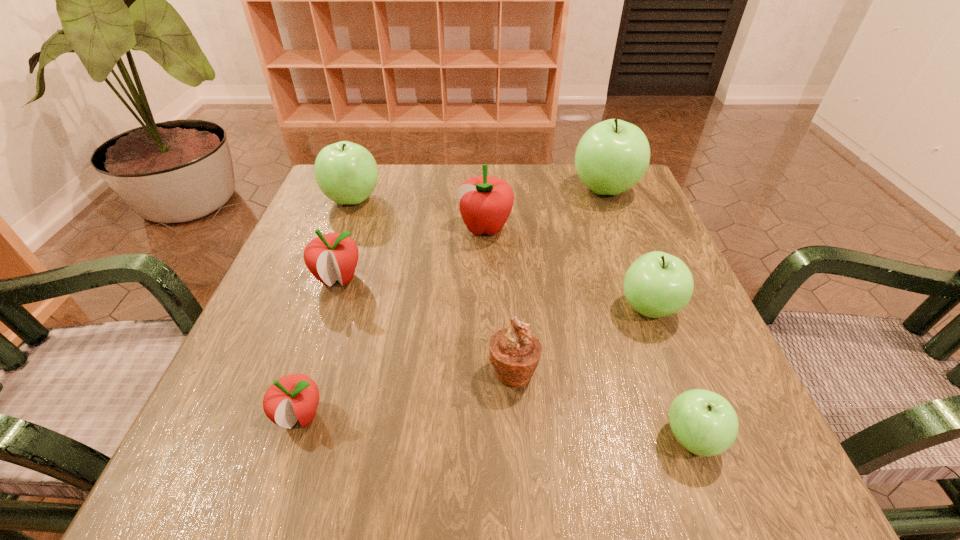
At what (x,y) coordinates should I click in order to perform the action: click on object that is at the far right corner. Please return your answer as a coordinate pair (x, y). Image resolution: width=960 pixels, height=540 pixels. Looking at the image, I should click on (612, 156).

What are the coordinates of `object situated at the near right corner` in the screenshot? It's located at (703, 422).

You are a GUI agent. You are given a task and a screenshot of the screen. Output one action in this format:
    pyautogui.click(x=<x>, y=<y>)
    Task: Click on the free space at the far edge
    
    Given the screenshot: What is the action you would take?
    pyautogui.click(x=400, y=175)

You are a GUI agent. You are given a task and a screenshot of the screen. Output one action in this format:
    pyautogui.click(x=<x>, y=<y>)
    Task: Click on the vacant region at the left edge of the desktop
    The width and height of the screenshot is (960, 540).
    Given the screenshot: What is the action you would take?
    pyautogui.click(x=274, y=318)

In order to click on free region at the right edge of the desktop in this screenshot , I will do `click(611, 231)`.

The image size is (960, 540). I want to click on free location at the far left corner of the desktop, so click(x=323, y=203).

The height and width of the screenshot is (540, 960). Identify the location of free region at the far right corner of the desktop. (631, 202).

At what (x,y) coordinates should I click in order to perform the action: click on free space at the near right corner of the desktop. Please return your answer as a coordinate pair (x, y). Looking at the image, I should click on (674, 471).

Where is `vacant region between the third smallest green apple and the smallest red apple`? The image size is (960, 540). vacant region between the third smallest green apple and the smallest red apple is located at coordinates pos(326,308).

You are a GUI agent. You are given a task and a screenshot of the screen. Output one action in this format:
    pyautogui.click(x=<x>, y=<y>)
    Task: Click on the free area in between the second smallest green apple and the tallest apple
    The height and width of the screenshot is (540, 960).
    Given the screenshot: What is the action you would take?
    pyautogui.click(x=627, y=249)